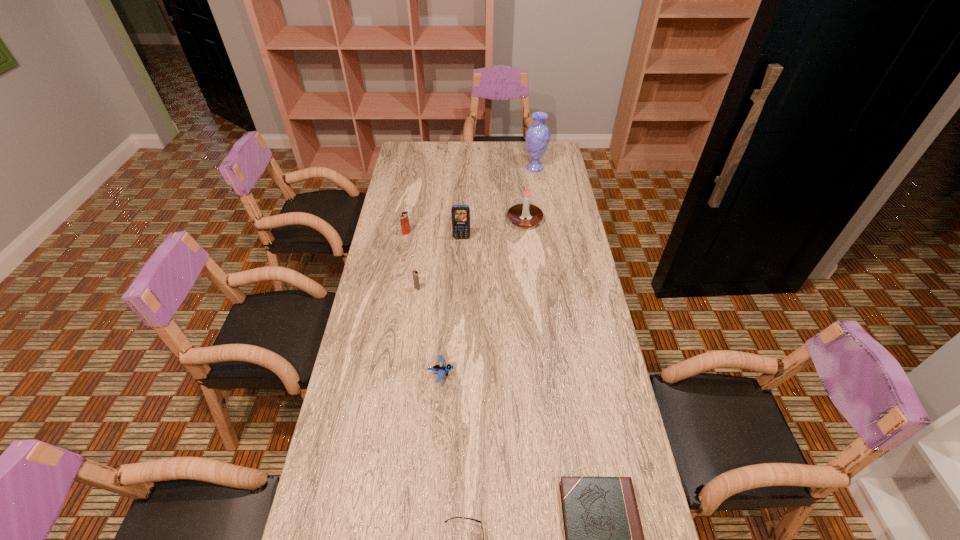
Identify the location of free space located on the left of the farthest object. This screenshot has width=960, height=540. (484, 167).

This screenshot has height=540, width=960. Identify the location of vacant area situated on the screen of the cellular telephone. (460, 287).

Where is `free region located on the back of the candle`? This screenshot has width=960, height=540. free region located on the back of the candle is located at coordinates (519, 169).

Identify the location of vacant space situated 0.130m on the back of the fifth shortest object. This screenshot has height=540, width=960. (410, 212).

Locate an element on the screen. free space located 0.240m on the right of the nearer igniter is located at coordinates (x=486, y=288).

What are the coordinates of `vacant position located on the front-facing side of the third shortest object` in the screenshot? It's located at (495, 373).

The width and height of the screenshot is (960, 540). Identify the location of object at the far edge. (537, 136).

This screenshot has height=540, width=960. I want to click on object located at the left edge, so click(x=404, y=219).

Find the location of a particular element. vase situated at the right edge is located at coordinates (537, 136).

Where is `candle that is at the right edge`? candle that is at the right edge is located at coordinates (517, 213).